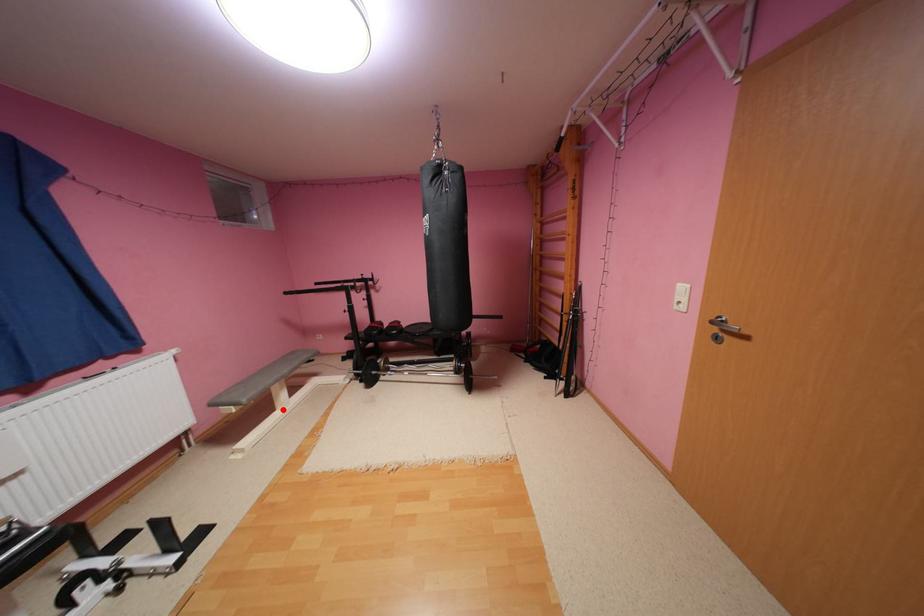
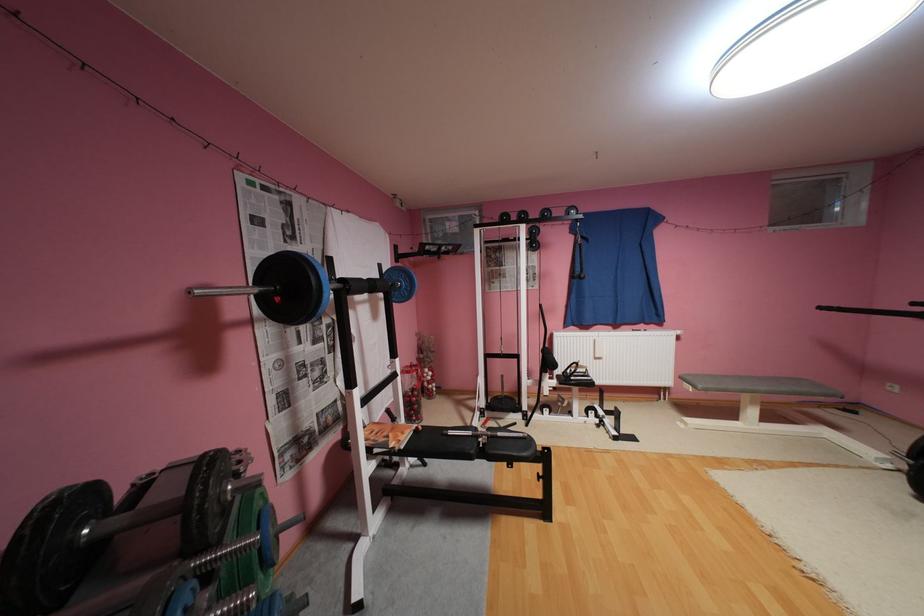
Question: I am providing you with two images of the same scene from different viewpoints. A red point is shown in image1. For the corresponding object point in image2, is it positioned nearer or farther from the camera?

Choices:
 (A) Nearer
 (B) Farther

Answer: (A)